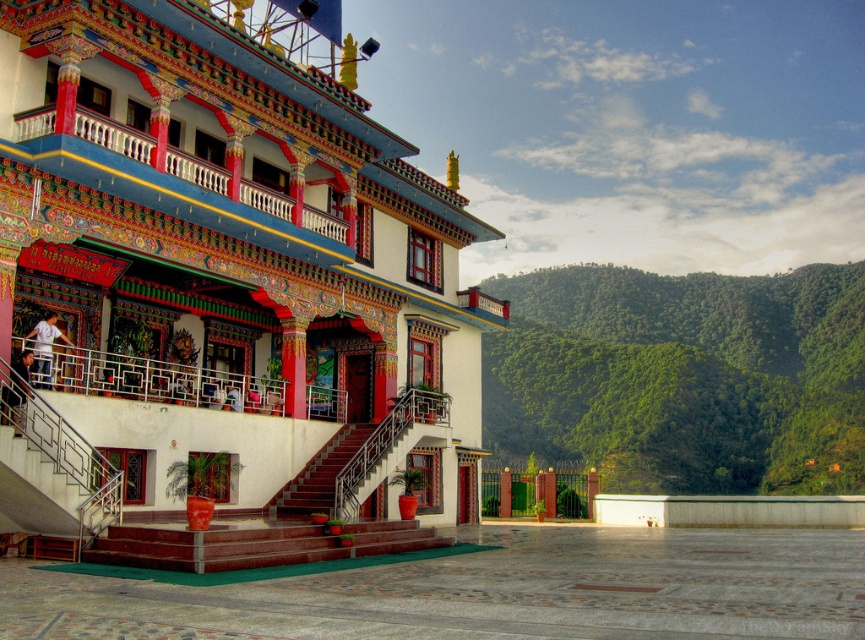
Based on the photo, you are an architect visiting this temple. You need to decide where to place a large decorative statue that requires a large flat surface. Based on the image, which object between the white painted wall at center and the metallic staircase at lower left would be more suitable for placing the statue?

The white painted wall at center is larger in size than the metallic staircase at lower left, making it more suitable for placing the large decorative statue requiring a large flat surface.

You are an architect visiting this temple. You notice the white painted wall at center and the maroon wooden stairs at center. Which of these two elements occupies a greater area in the image?

The white painted wall at center is larger in size than the maroon wooden stairs at center, so the white painted wall at center occupies a greater area in the image.

You are standing in front of the temple and notice two points marked on the building. The first point is at coordinate point (383, 172) and the second is at point (315, 506). From your perspective, which point is closer to you?

Point (315, 506) is closer to you because the description states that point (383, 172) is behind point (315, 506).